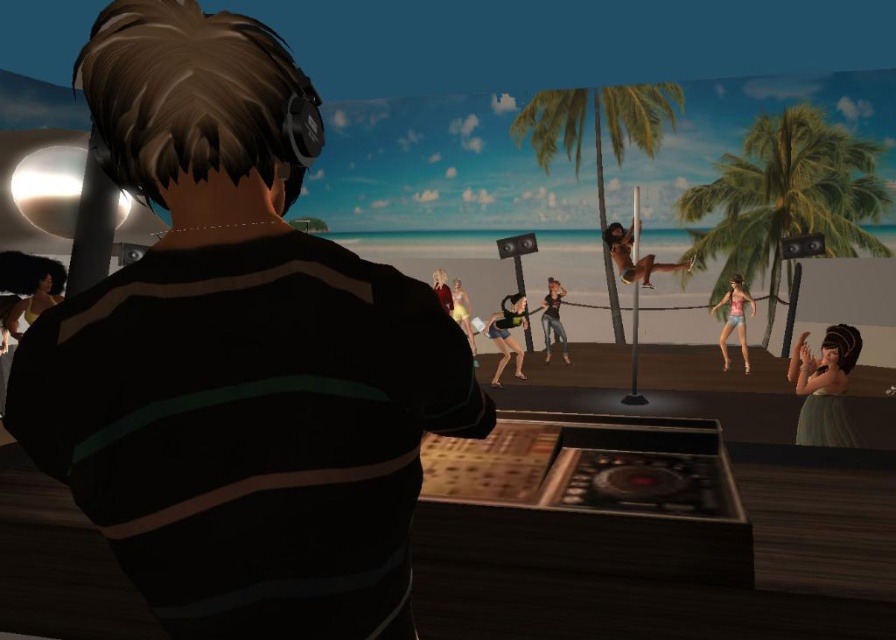
Question: Which object appears farthest from the camera in this image?

Choices:
 (A) yellow matte swimsuit at center
 (B) striped fabric shirt at center

Answer: (A)

Question: Is striped fabric shirt at center further to camera compared to yellow matte swimsuit at center?

Choices:
 (A) yes
 (B) no

Answer: (B)

Question: Can you confirm if matte black bikini at center is positioned to the right of yellow matte swimsuit at center?

Choices:
 (A) no
 (B) yes

Answer: (B)

Question: Which point appears farthest from the camera in this image?

Choices:
 (A) (734, 291)
 (B) (811, 403)
 (C) (441, 292)
 (D) (642, 260)

Answer: (C)

Question: Which point appears farthest from the camera in this image?

Choices:
 (A) (666, 268)
 (B) (470, 307)

Answer: (B)

Question: Can you confirm if matte yellow wig at lower left is smaller than smooth skin at center?

Choices:
 (A) no
 (B) yes

Answer: (A)